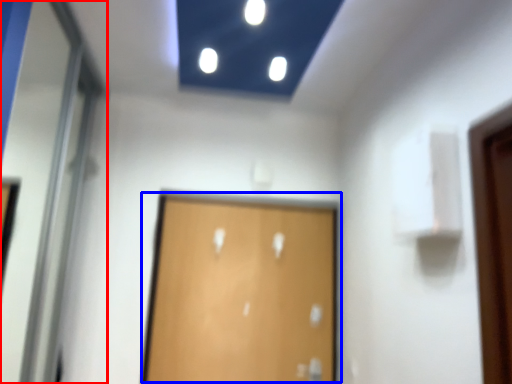
Question: Among these objects, which one is farthest to the camera, elevator door (highlighted by a red box) or door (highlighted by a blue box)?

Choices:
 (A) elevator door
 (B) door

Answer: (B)